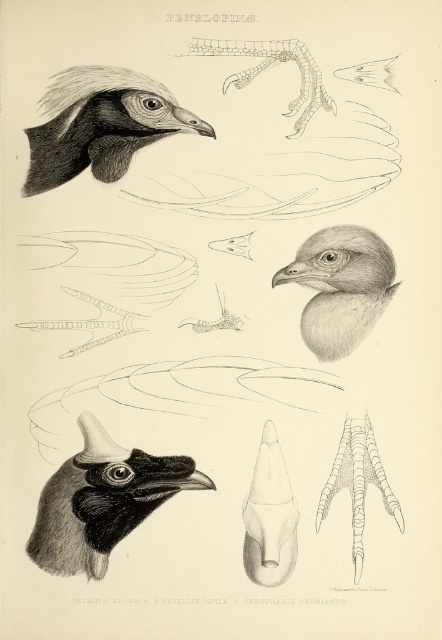
Based on the illustration of Penelopidae birds, which of the two heads, the smooth black head at upper left or the smooth gray head at center, is bigger in size?

The smooth black head at upper left has a larger size compared to the smooth gray head at center.

You are an ornithologist examining the illustration. You notice the black matte head at lower left and the smooth gray head at center. Which head is closer to you in the illustration?

The black matte head at lower left is closer to you because it is positioned in front of the smooth gray head at center.

You are a researcher examining the illustration of Penelopidae birds. You notice a point marked at coordinates (102,500). Based on the illustration, what anatomical feature is located at this point?

The point at coordinates (102,500) indicates the black matte head at lower left.